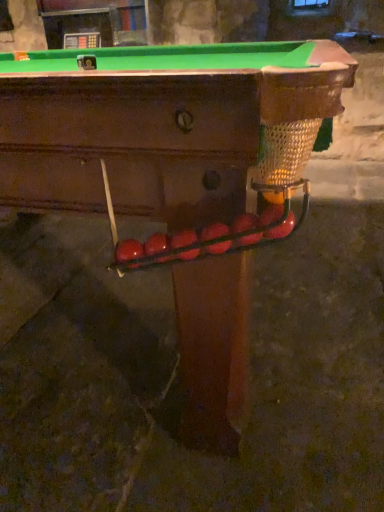
The width and height of the screenshot is (384, 512). What do you see at coordinates (156, 243) in the screenshot?
I see `glossy red balls at center, placed as the 2th fruit when sorted from left to right` at bounding box center [156, 243].

Find the location of a particular element. The image size is (384, 512). rubberized red ball at center, which appears as the 3th fruit when viewed from the left is located at coordinates (185, 244).

Locate an element on the screen. This screenshot has height=512, width=384. glossy red ball at center, the 2th fruit from the right is located at coordinates (245, 223).

The width and height of the screenshot is (384, 512). Find the location of `glossy red ball at center, the 4th fruit viewed from the left`. glossy red ball at center, the 4th fruit viewed from the left is located at coordinates (214, 231).

Based on the photo, from a real-world perspective, which is physically below, rubberized red ball at center, placed as the fourth fruit when sorted from right to left, or glossy red apple at right, placed as the sixth fruit when sorted from left to right?

In real-world perspective, rubberized red ball at center, placed as the fourth fruit when sorted from right to left, is lower.

Would you say rubberized red ball at center, which appears as the 3th fruit when viewed from the left, is inside or outside glossy red apple at right, which ranks as the first fruit in right-to-left order?

rubberized red ball at center, which appears as the 3th fruit when viewed from the left, lies outside glossy red apple at right, which ranks as the first fruit in right-to-left order.

Could you measure the distance between rubberized red ball at center, placed as the fourth fruit when sorted from right to left, and glossy red apple at right, placed as the sixth fruit when sorted from left to right?

They are 5.56 inches apart.

Which object is positioned more to the right, rubberized red ball at center, placed as the fourth fruit when sorted from right to left, or glossy red apple at right, placed as the sixth fruit when sorted from left to right?

From the viewer's perspective, glossy red apple at right, placed as the sixth fruit when sorted from left to right, appears more on the right side.

Considering the sizes of objects rubberized red ball at center, which appears as the 3th fruit when viewed from the left, and glossy red ball at center, the 2th fruit from the right, in the image provided, who is wider, rubberized red ball at center, which appears as the 3th fruit when viewed from the left, or glossy red ball at center, the 2th fruit from the right,?

With larger width is glossy red ball at center, the 2th fruit from the right.

Which is further, (188,249) or (240,219)?

Positioned behind is point (188,249).

Is rubberized red ball at center, which appears as the 3th fruit when viewed from the left, positioned far away from glossy red ball at center, which ranks as the fifth fruit in left-to-right order?

No, there isn't a large distance between rubberized red ball at center, which appears as the 3th fruit when viewed from the left, and glossy red ball at center, which ranks as the fifth fruit in left-to-right order.

Does point (154, 240) appear closer or farther from the camera than point (218, 252)?

Point (154, 240) is closer to the camera than point (218, 252).

Relative to glossy red ball at center, placed as the 3th fruit when sorted from right to left, is glossy red balls at center, the fifth fruit in the right-to-left sequence, in front or behind?

In the image, glossy red balls at center, the fifth fruit in the right-to-left sequence, appears behind glossy red ball at center, placed as the 3th fruit when sorted from right to left.

From the picture: From their relative heights in the image, would you say glossy red balls at center, the fifth fruit in the right-to-left sequence, is taller or shorter than glossy red ball at center, placed as the 3th fruit when sorted from right to left?

In the image, glossy red balls at center, the fifth fruit in the right-to-left sequence, appears to be shorter than glossy red ball at center, placed as the 3th fruit when sorted from right to left.

From a real-world perspective, is glossy red balls at center, the fifth fruit in the right-to-left sequence, under glossy red ball at center, the 4th fruit viewed from the left?

Yes.

Can you see glossy red apple at right, placed as the sixth fruit when sorted from left to right, touching glossy red balls at center, the fifth fruit in the right-to-left sequence?

There is a gap between glossy red apple at right, placed as the sixth fruit when sorted from left to right, and glossy red balls at center, the fifth fruit in the right-to-left sequence.

Is glossy red apple at right, placed as the sixth fruit when sorted from left to right, spatially inside glossy red balls at center, placed as the 2th fruit when sorted from left to right, or outside of it?

glossy red apple at right, placed as the sixth fruit when sorted from left to right, is spatially situated outside glossy red balls at center, placed as the 2th fruit when sorted from left to right.

From the image's perspective, is glossy red apple at right, which ranks as the first fruit in right-to-left order, located above glossy red balls at center, placed as the 2th fruit when sorted from left to right?

Correct, glossy red apple at right, which ranks as the first fruit in right-to-left order, appears higher than glossy red balls at center, placed as the 2th fruit when sorted from left to right, in the image.

In the scene shown: Is glossy red apple at right, which ranks as the first fruit in right-to-left order, further to the viewer compared to glossy red balls at center, placed as the 2th fruit when sorted from left to right?

Answer: No.

Between glossy red apple at lower center, the first fruit when ordered from left to right, and glossy red ball at center, the 4th fruit viewed from the left, which one has more height?

glossy red ball at center, the 4th fruit viewed from the left.

Between glossy red apple at lower center, the 6th fruit viewed from the right, and glossy red ball at center, the 4th fruit viewed from the left, which one is positioned behind?

glossy red apple at lower center, the 6th fruit viewed from the right, is further from the camera.

Which is farther, (130, 253) or (223, 248)?

Positioned behind is point (130, 253).

From the image's perspective, which one is positioned lower, glossy red apple at lower center, the 6th fruit viewed from the right, or glossy red ball at center, placed as the 3th fruit when sorted from right to left?

glossy red apple at lower center, the 6th fruit viewed from the right.

Considering the relative sizes of glossy red apple at lower center, the 6th fruit viewed from the right, and glossy red apple at right, which ranks as the first fruit in right-to-left order, in the image provided, is glossy red apple at lower center, the 6th fruit viewed from the right, shorter than glossy red apple at right, which ranks as the first fruit in right-to-left order,?

Correct, glossy red apple at lower center, the 6th fruit viewed from the right, is not as tall as glossy red apple at right, which ranks as the first fruit in right-to-left order.

From the image's perspective, is glossy red apple at lower center, the first fruit when ordered from left to right, located above glossy red apple at right, placed as the sixth fruit when sorted from left to right?

No, from the image's perspective, glossy red apple at lower center, the first fruit when ordered from left to right, is not on top of glossy red apple at right, placed as the sixth fruit when sorted from left to right.

Which is correct: glossy red apple at lower center, the 6th fruit viewed from the right, is inside glossy red apple at right, placed as the sixth fruit when sorted from left to right, or outside of it?

The correct answer is: outside.

Does glossy red apple at lower center, the first fruit when ordered from left to right, turn towards glossy red apple at right, placed as the sixth fruit when sorted from left to right?

No, glossy red apple at lower center, the first fruit when ordered from left to right, is not facing towards glossy red apple at right, placed as the sixth fruit when sorted from left to right.

Choose the correct answer: Is glossy red balls at center, placed as the 2th fruit when sorted from left to right, inside glossy red apple at lower center, the 6th fruit viewed from the right, or outside it?

glossy red balls at center, placed as the 2th fruit when sorted from left to right, is located beyond the bounds of glossy red apple at lower center, the 6th fruit viewed from the right.

How much distance is there between glossy red balls at center, placed as the 2th fruit when sorted from left to right, and glossy red apple at lower center, the 6th fruit viewed from the right?

They are 1.53 inches apart.

Considering the relative sizes of glossy red balls at center, placed as the 2th fruit when sorted from left to right, and glossy red apple at lower center, the first fruit when ordered from left to right, in the image provided, is glossy red balls at center, placed as the 2th fruit when sorted from left to right, wider than glossy red apple at lower center, the first fruit when ordered from left to right,?

No, glossy red balls at center, placed as the 2th fruit when sorted from left to right, is not wider than glossy red apple at lower center, the first fruit when ordered from left to right.

In terms of height, does glossy red balls at center, placed as the 2th fruit when sorted from left to right, look taller or shorter compared to glossy red apple at lower center, the first fruit when ordered from left to right?

In the image, glossy red balls at center, placed as the 2th fruit when sorted from left to right, appears to be shorter than glossy red apple at lower center, the first fruit when ordered from left to right.

Identify the location of fruit that is the 3rd object to the left of the glossy red apple at right, placed as the sixth fruit when sorted from left to right, starting at the anchor. (185, 244).

There is a glossy red ball at center, which ranks as the fifth fruit in left-to-right order. Find the location of `the 2nd fruit below it (from the image's perspective)`. the 2nd fruit below it (from the image's perspective) is located at coordinates (185, 244).

From the image, which object appears to be nearer to glossy red apple at lower center, the first fruit when ordered from left to right, glossy red balls at center, the fifth fruit in the right-to-left sequence, or glossy red apple at right, placed as the sixth fruit when sorted from left to right?

The object closer to glossy red apple at lower center, the first fruit when ordered from left to right, is glossy red balls at center, the fifth fruit in the right-to-left sequence.

Based on their spatial positions, is rubberized red ball at center, which appears as the 3th fruit when viewed from the left, or glossy red apple at right, placed as the sixth fruit when sorted from left to right, closer to glossy red ball at center, the 4th fruit viewed from the left?

Among the two, rubberized red ball at center, which appears as the 3th fruit when viewed from the left, is located nearer to glossy red ball at center, the 4th fruit viewed from the left.

Considering their positions, is glossy red ball at center, the 2th fruit from the right, positioned further to rubberized red ball at center, which appears as the 3th fruit when viewed from the left, than glossy red ball at center, placed as the 3th fruit when sorted from right to left?

glossy red ball at center, the 2th fruit from the right, lies further to rubberized red ball at center, which appears as the 3th fruit when viewed from the left, than the other object.

Estimate the real-world distances between objects in this image. Which object is further from glossy red ball at center, the 2th fruit from the right, glossy red apple at right, placed as the sixth fruit when sorted from left to right, or glossy red balls at center, the fifth fruit in the right-to-left sequence?

glossy red balls at center, the fifth fruit in the right-to-left sequence, lies further to glossy red ball at center, the 2th fruit from the right, than the other object.

Which object lies nearer to the anchor point glossy red ball at center, the 2th fruit from the right, glossy red balls at center, the fifth fruit in the right-to-left sequence, or glossy red ball at center, placed as the 3th fruit when sorted from right to left?

Based on the image, glossy red ball at center, placed as the 3th fruit when sorted from right to left, appears to be nearer to glossy red ball at center, the 2th fruit from the right.

Looking at the image, which one is located further to glossy red ball at center, the 2th fruit from the right, glossy red apple at right, which ranks as the first fruit in right-to-left order, or glossy red apple at lower center, the 6th fruit viewed from the right?

glossy red apple at lower center, the 6th fruit viewed from the right, is positioned further to the anchor glossy red ball at center, the 2th fruit from the right.

Looking at the image, which one is located further to glossy red apple at lower center, the first fruit when ordered from left to right, glossy red ball at center, the 2th fruit from the right, or glossy red apple at right, which ranks as the first fruit in right-to-left order?

glossy red apple at right, which ranks as the first fruit in right-to-left order, lies further to glossy red apple at lower center, the first fruit when ordered from left to right, than the other object.

Which object lies nearer to the anchor point glossy red apple at lower center, the first fruit when ordered from left to right, glossy red apple at right, placed as the sixth fruit when sorted from left to right, or glossy red ball at center, the 2th fruit from the right?

glossy red ball at center, the 2th fruit from the right, is closer to glossy red apple at lower center, the first fruit when ordered from left to right.

You are a GUI agent. You are given a task and a screenshot of the screen. Output one action in this format:
    pyautogui.click(x=<x>, y=<y>)
    Task: Click on the fruit between glossy red balls at center, placed as the 2th fruit when sorted from left to right, and glossy red ball at center, placed as the 3th fruit when sorted from right to left
    Image resolution: width=384 pixels, height=512 pixels.
    Given the screenshot: What is the action you would take?
    (185, 244)

Find the location of a particular element. fruit between glossy red apple at lower center, the first fruit when ordered from left to right, and rubberized red ball at center, which appears as the 3th fruit when viewed from the left is located at coordinates (156, 243).

Where is `fruit between glossy red ball at center, placed as the 3th fruit when sorted from right to left, and glossy red apple at right, placed as the sixth fruit when sorted from left to right`? This screenshot has width=384, height=512. fruit between glossy red ball at center, placed as the 3th fruit when sorted from right to left, and glossy red apple at right, placed as the sixth fruit when sorted from left to right is located at coordinates (245, 223).

Where is `fruit between rubberized red ball at center, placed as the fourth fruit when sorted from right to left, and glossy red ball at center, which ranks as the fifth fruit in left-to-right order, in the horizontal direction`? This screenshot has height=512, width=384. fruit between rubberized red ball at center, placed as the fourth fruit when sorted from right to left, and glossy red ball at center, which ranks as the fifth fruit in left-to-right order, in the horizontal direction is located at coordinates (214, 231).